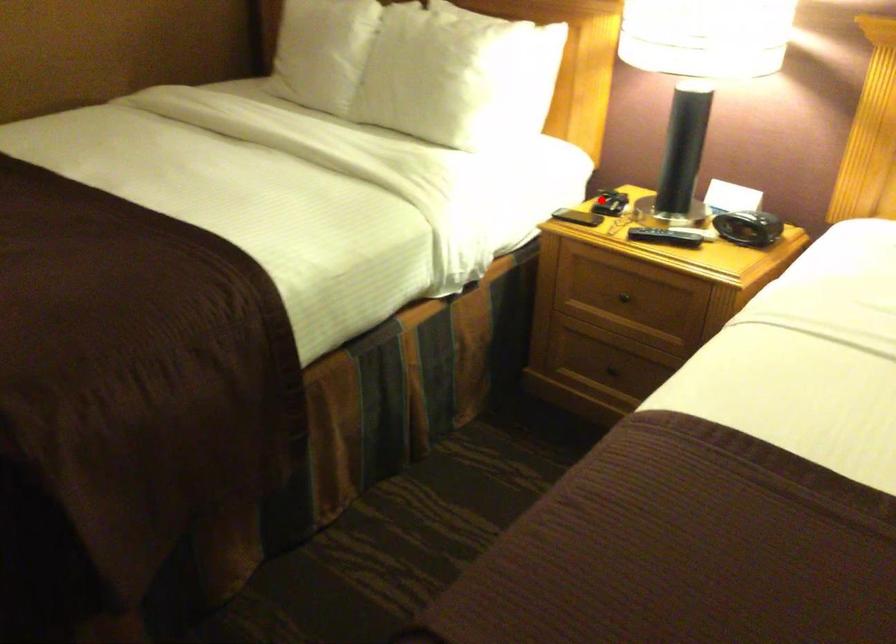
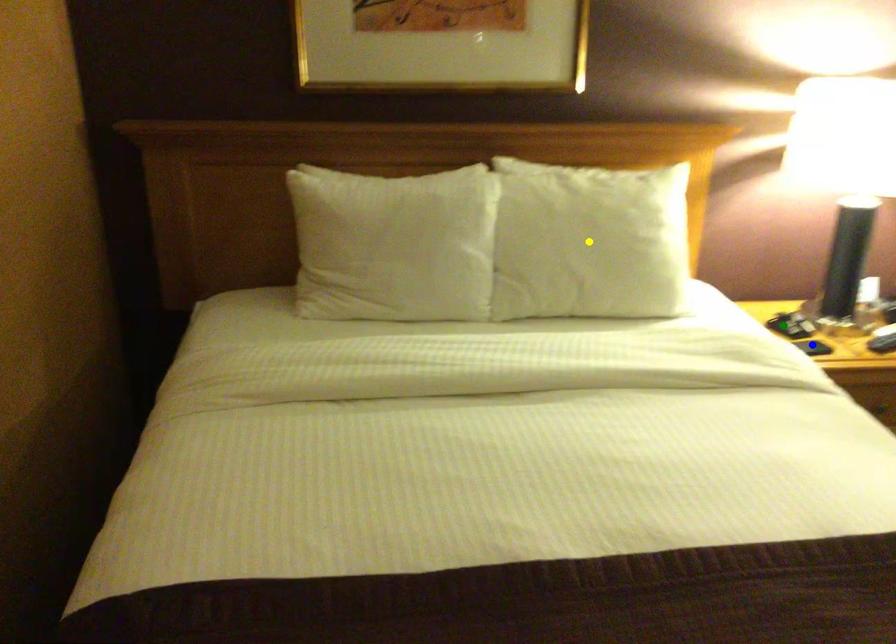
Question: I am providing you with two images of the same scene from different viewpoints. A red point is marked on the first image. You are given multiple points on the second image. Which point in image 2 is actually the same real-world point as the red point in image 1?

Choices:
 (A) green point
 (B) yellow point
 (C) blue point

Answer: (A)